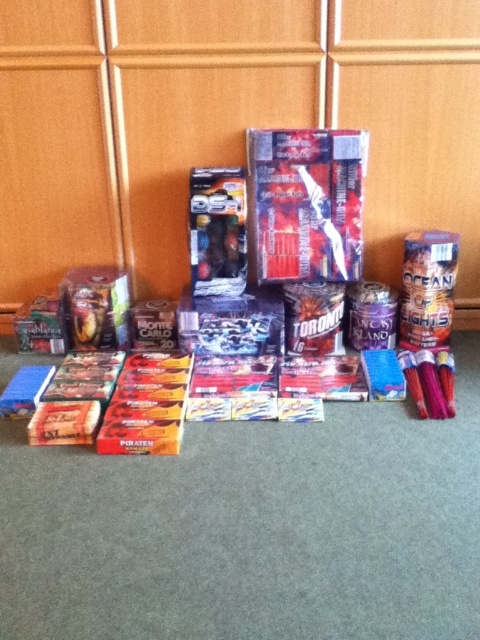
Question: Is metallic silver fireworks at center wider than metallic silver toy car at center?

Choices:
 (A) yes
 (B) no

Answer: (A)

Question: Which object is the farthest from the metallic silver snack at right?

Choices:
 (A) metallic silver toy car at center
 (B) shiny metallic box at center

Answer: (A)

Question: Among these objects, which one is nearest to the camera?

Choices:
 (A) shiny metallic box at center
 (B) metallic silver snack at right
 (C) metallic silver fireworks at center
 (D) metallic silver toy car at center

Answer: (C)

Question: Which of the following is the farthest from the observer?

Choices:
 (A) (190, 198)
 (B) (436, 269)
 (C) (301, 184)

Answer: (A)

Question: Does shiny metallic box at center appear under metallic silver toy car at center?

Choices:
 (A) yes
 (B) no

Answer: (B)

Question: Observing the image, what is the correct spatial positioning of shiny metallic box at center in reference to metallic silver snack at right?

Choices:
 (A) left
 (B) right

Answer: (A)